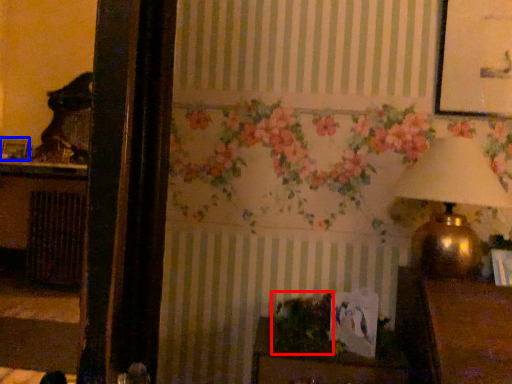
Question: Which of the following is the farthest to the observer, plant (highlighted by a red box) or picture frame (highlighted by a blue box)?

Choices:
 (A) plant
 (B) picture frame

Answer: (B)